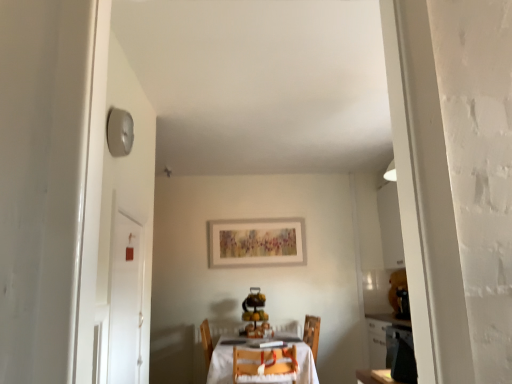
This screenshot has width=512, height=384. What do you see at coordinates (265, 366) in the screenshot?
I see `wooden chair at center` at bounding box center [265, 366].

What are the coordinates of `white glossy door at left` in the screenshot? It's located at (125, 298).

How many degrees apart are the facing directions of white wooden table at center and wooden chair at center?

The facing directions of white wooden table at center and wooden chair at center are 180 degrees apart.

From the image's perspective, is white wooden table at center located above wooden chair at center?

No, from the image's perspective, white wooden table at center is not on top of wooden chair at center.

Does white wooden table at center have a greater height compared to wooden chair at center?

Correct, white wooden table at center is much taller as wooden chair at center.

Is white wooden table at center positioned far away from wooden chair at center?

No, there isn't a large distance between white wooden table at center and wooden chair at center.

Is white glossy door at left positioned with its back to white wooden table at center?

No, white wooden table at center is not at the back of white glossy door at left.

Considering the sizes of objects white glossy door at left and white wooden table at center in the image provided, who is taller, white glossy door at left or white wooden table at center?

white glossy door at left is taller.

From a real-world perspective, which is physically above, white glossy door at left or white wooden table at center?

white glossy door at left, from a real-world perspective.

Is white glossy door at left thinner than wooden chair at center?

Yes, white glossy door at left is thinner than wooden chair at center.

Which of these two, white glossy door at left or wooden chair at center, stands taller?

white glossy door at left is taller.

From a real-world perspective, which is physically above, white glossy door at left or wooden chair at center?

In real-world perspective, white glossy door at left is above.

From the image's perspective, which one is positioned higher, white glossy door at left or wooden chair at center?

white glossy door at left.

Is there a large distance between wooden chair at center and white glossy door at left?

Yes, wooden chair at center and white glossy door at left are located far from each other.

Can you tell me how much wooden chair at center and white glossy door at left differ in facing direction?

The facing directions of wooden chair at center and white glossy door at left are 90 degrees apart.

From a real-world perspective, which object rests below the other?

In real-world perspective, wooden chair at center is lower.

Is white wooden table at center bigger than white glossy door at left?

Indeed, white wooden table at center has a larger size compared to white glossy door at left.

Is white wooden table at center positioned with its back to white glossy door at left?

That's not correct — white wooden table at center is not looking away from white glossy door at left.

From a real-world perspective, is white wooden table at center positioned under white glossy door at left based on gravity?

Yes, from a real-world perspective, white wooden table at center is below white glossy door at left.

Which is farther from the camera, (231, 348) or (134, 259)?

The point (231, 348) is more distant.

Which point is more forward, (x=268, y=374) or (x=211, y=363)?

Positioned in front is point (x=268, y=374).

Looking at their sizes, would you say wooden chair at center is wider or thinner than white wooden table at center?

wooden chair at center is thinner than white wooden table at center.

Are wooden chair at center and white wooden table at center beside each other?

wooden chair at center is not next to white wooden table at center, and they're not touching.

Can you tell me how much wooden chair at center and white wooden table at center differ in facing direction?

180 degrees.

Locate an element on the screen. Image resolution: width=512 pixels, height=384 pixels. chair on the right of white wooden table at center is located at coordinates (265, 366).

The height and width of the screenshot is (384, 512). I want to click on door on the left of white wooden table at center, so click(125, 298).

Estimate the real-world distances between objects in this image. Which object is further from white glossy door at left, wooden chair at center or white wooden table at center?

The object further to white glossy door at left is white wooden table at center.

Estimate the real-world distances between objects in this image. Which object is further from white wooden table at center, white glossy door at left or wooden chair at center?

The object further to white wooden table at center is white glossy door at left.

When comparing their distances from wooden chair at center, does white wooden table at center or white glossy door at left seem further?

white glossy door at left is further to wooden chair at center.

Considering their positions, is white glossy door at left positioned further to wooden chair at center than white wooden table at center?

white glossy door at left.

Looking at the image, which one is located closer to white glossy door at left, white wooden table at center or wooden chair at center?

Based on the image, wooden chair at center appears to be nearer to white glossy door at left.

In the scene shown: Based on their spatial positions, is wooden chair at center or white glossy door at left further from white wooden table at center?

white glossy door at left is further to white wooden table at center.

Identify the location of chair between white glossy door at left and white wooden table at center in the front-back direction. Image resolution: width=512 pixels, height=384 pixels. (265, 366).